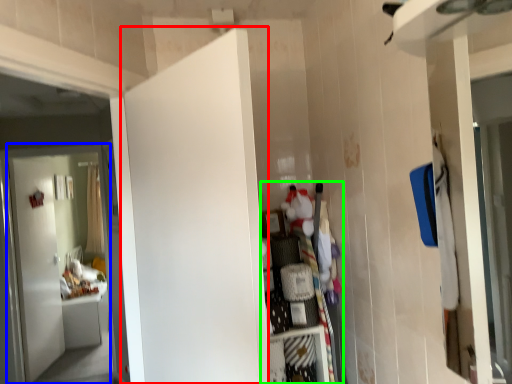
Question: Considering the real-world distances, which object is closest to door (highlighted by a red box)? door (highlighted by a blue box) or dresser (highlighted by a green box).

Choices:
 (A) door
 (B) dresser

Answer: (B)